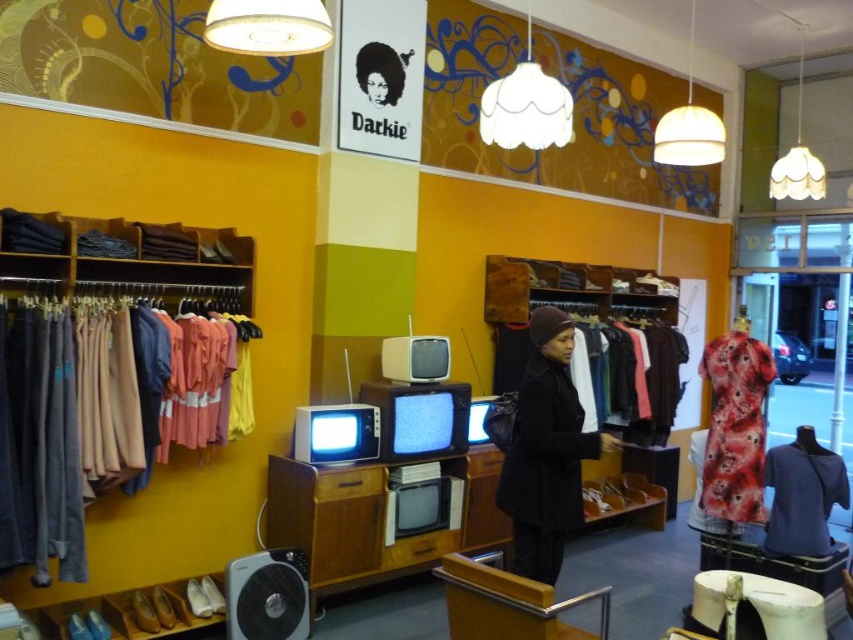
Question: Based on their relative distances, which object is nearer to the matte black afro at upper center?

Choices:
 (A) black wool coat at center
 (B) floral silk dress at right

Answer: (A)

Question: Which point is closer to the camera?

Choices:
 (A) (792, 460)
 (B) (39, 348)
 (C) (535, 524)
 (D) (393, 58)

Answer: (B)

Question: Does black wool coat at center appear under matte black afro at upper center?

Choices:
 (A) yes
 (B) no

Answer: (A)

Question: Which point is closer to the camera?

Choices:
 (A) black wool coat at center
 (B) floral silk dress at right
 (C) matte black afro at upper center

Answer: (A)

Question: Can you confirm if soft cotton shirts at left is positioned to the left of matte black afro at upper center?

Choices:
 (A) no
 (B) yes

Answer: (B)

Question: Is black wool coat at center to the right of blue cotton shirt at center from the viewer's perspective?

Choices:
 (A) yes
 (B) no

Answer: (B)